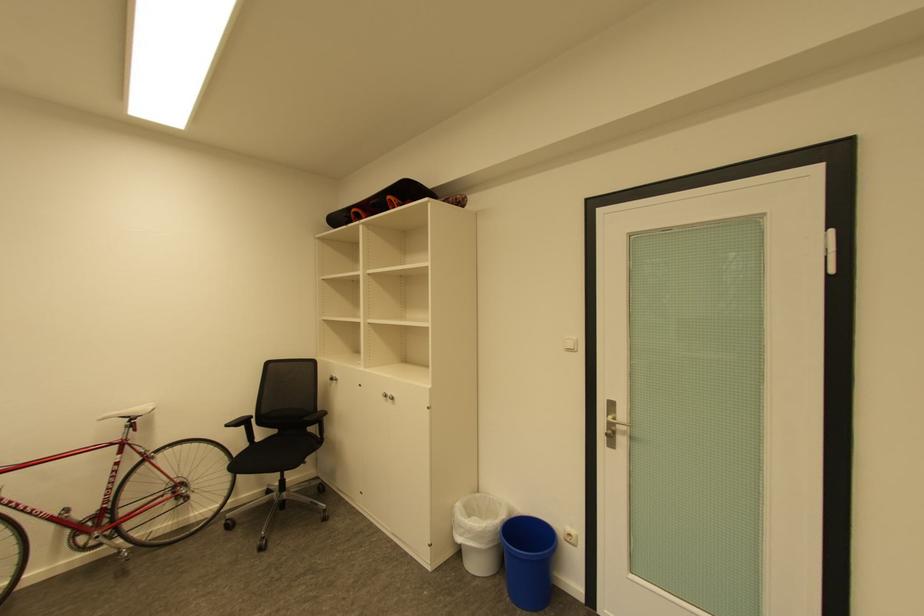
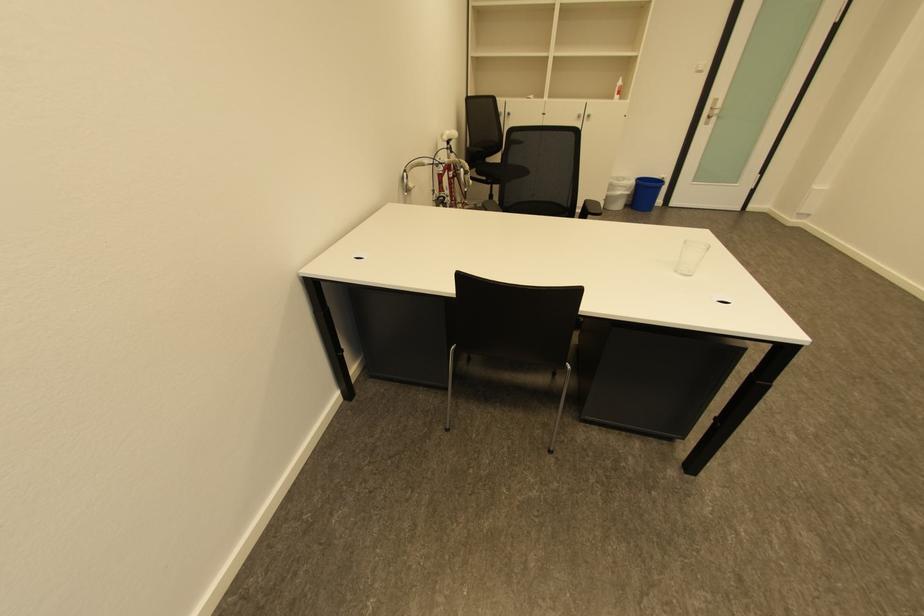
The point at (468, 528) is marked in the first image. Where is the corresponding point in the second image?

(626, 188)